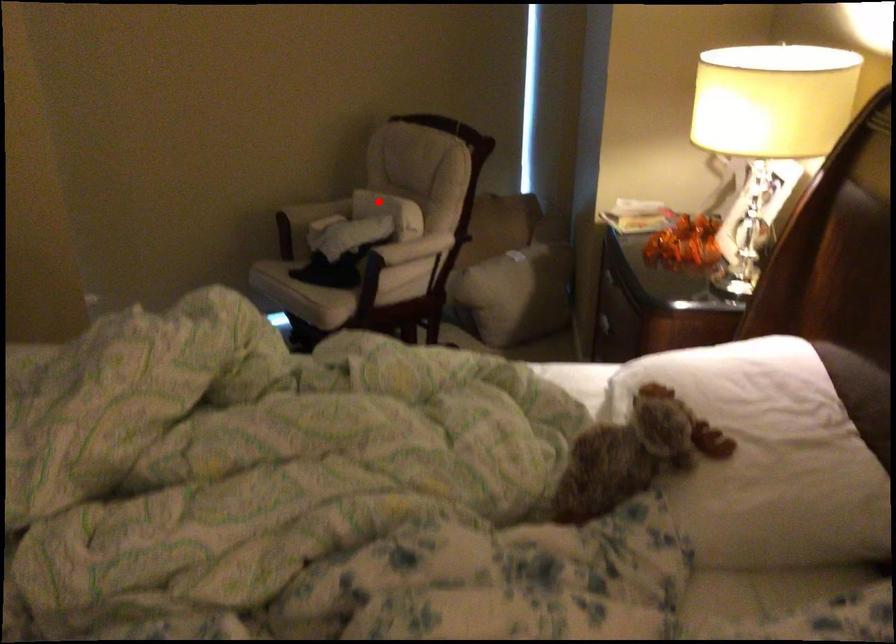
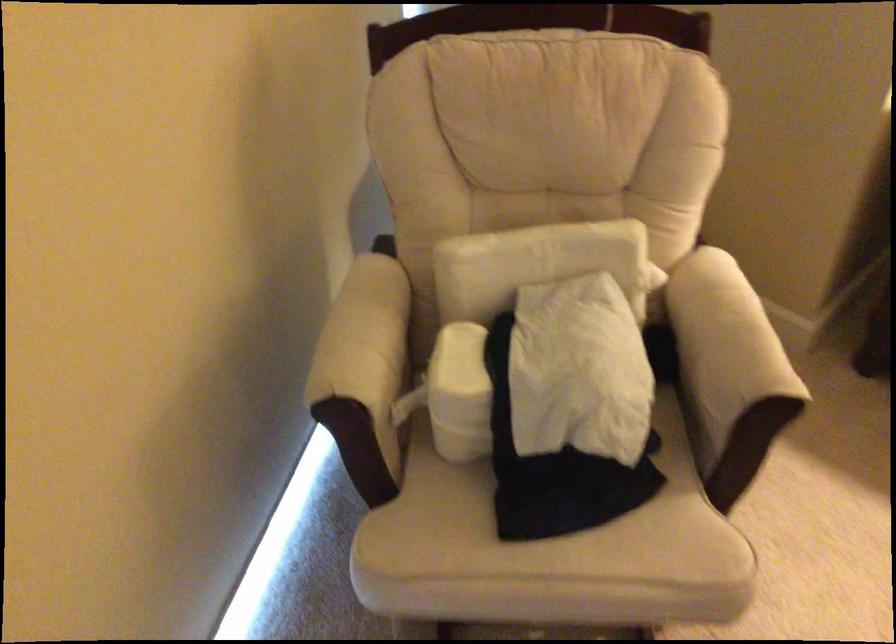
Question: I am providing you with two images of the same scene from different viewpoints. A red point is shown in image1. For the corresponding object point in image2, is it positioned nearer or farther from the camera?

Choices:
 (A) Nearer
 (B) Farther

Answer: (A)